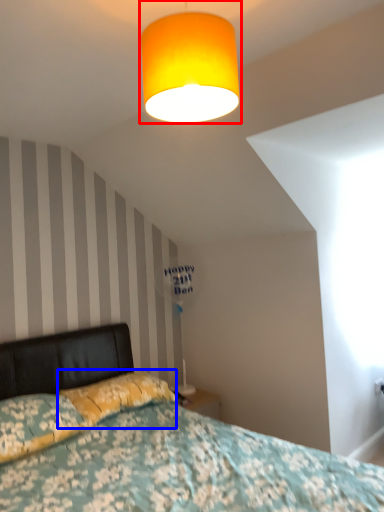
Question: Among these objects, which one is farthest to the camera, lamp (highlighted by a red box) or pillow (highlighted by a blue box)?

Choices:
 (A) lamp
 (B) pillow

Answer: (B)